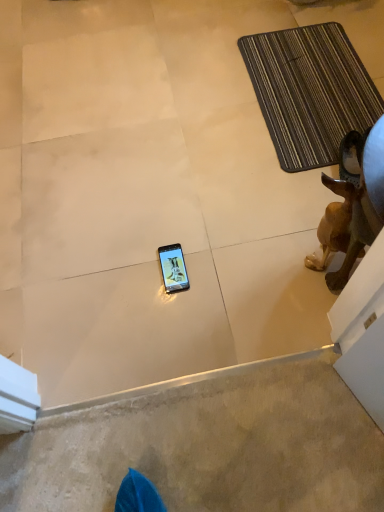
Question: In terms of height, does smooth beige carpet at lower center look taller or shorter compared to brown striped bath mat at upper right?

Choices:
 (A) short
 (B) tall

Answer: (A)

Question: Is smooth beige carpet at lower center bigger or smaller than brown striped bath mat at upper right?

Choices:
 (A) small
 (B) big

Answer: (A)

Question: Which is nearer to the brown striped bath mat at upper right?

Choices:
 (A) smooth beige carpet at lower center
 (B) brown matte dog at right

Answer: (B)

Question: Estimate the real-world distances between objects in this image. Which object is closer to the smooth beige carpet at lower center?

Choices:
 (A) brown striped bath mat at upper right
 (B) brown matte dog at right

Answer: (B)